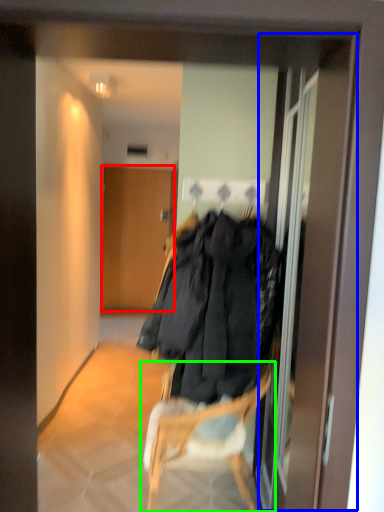
Question: Which is nearer to the door (highlighted by a red box)? screen door (highlighted by a blue box) or chair (highlighted by a green box).

Choices:
 (A) screen door
 (B) chair

Answer: (A)